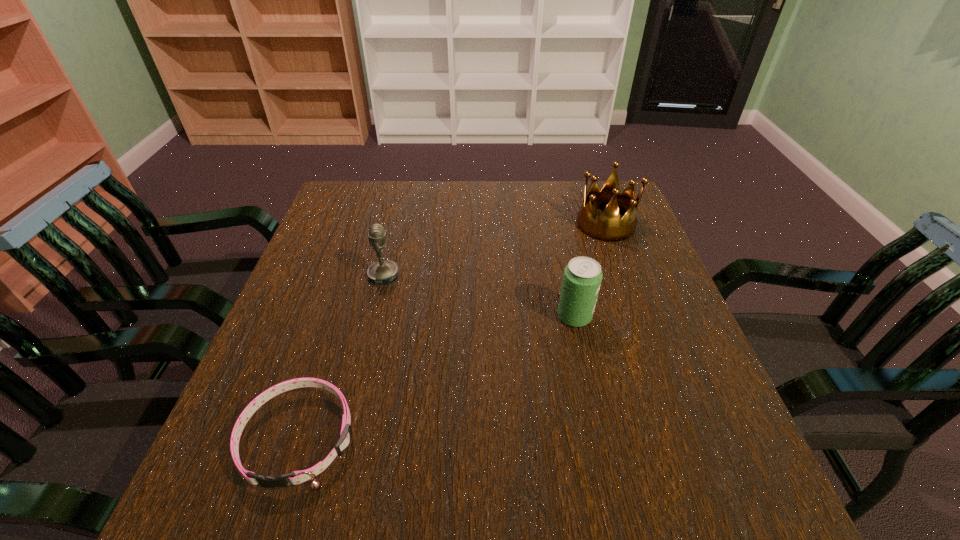
Locate an element on the screen. the rightmost object is located at coordinates (608, 227).

I want to click on the farthest object, so click(x=608, y=227).

The image size is (960, 540). What are the coordinates of `the third nearest object` in the screenshot? It's located at (384, 272).

The width and height of the screenshot is (960, 540). What are the coordinates of `soda` in the screenshot? It's located at (582, 277).

This screenshot has width=960, height=540. I want to click on the third object from left to right, so click(582, 277).

This screenshot has height=540, width=960. Find the location of `the shortest object`. the shortest object is located at coordinates pyautogui.click(x=296, y=477).

Find the location of a particular element. The width and height of the screenshot is (960, 540). the nearest object is located at coordinates (296, 477).

Locate an element on the screen. This screenshot has width=960, height=540. free space located 0.350m on the left of the farthest object is located at coordinates coord(453,224).

The width and height of the screenshot is (960, 540). In order to click on vacant space located on the front-facing side of the microphone in this screenshot , I will do `click(485, 275)`.

Find the location of a particular element. The width and height of the screenshot is (960, 540). vacant space located 0.350m on the front of the third farthest object is located at coordinates [x=613, y=497].